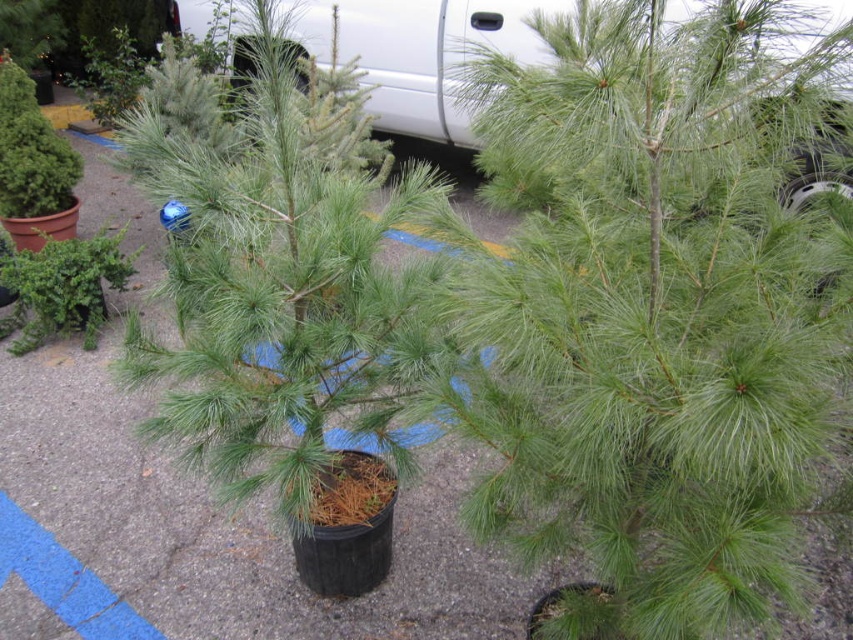
You are a customer at the garden center and want to plant a new pine tree in your backyard. You see the point marked at coordinate (654, 312). What object is located at that point?

The point at coordinate (654, 312) indicates the green matte tree at center.

You are a delivery person who needs to move a large box from the white matte car at upper center to the green matte tree at center. The box is 6 feet long. Can you carry it horizontally without tilting it between these two points?

The distance between the green matte tree at center and white matte car at upper center is 7.60 feet. Since the box is 6 feet long, it can be carried horizontally as the distance is sufficient.

You are a landscape architect planning to place a new sign in this garden area. The sign will be placed between the green matte tree at center and the white matte car at upper center. Considering their heights, which object will the sign be closer to in terms of height?

The green matte tree at center is taller than the white matte car at upper center, so the sign will be closer in height to the white matte car at upper center.